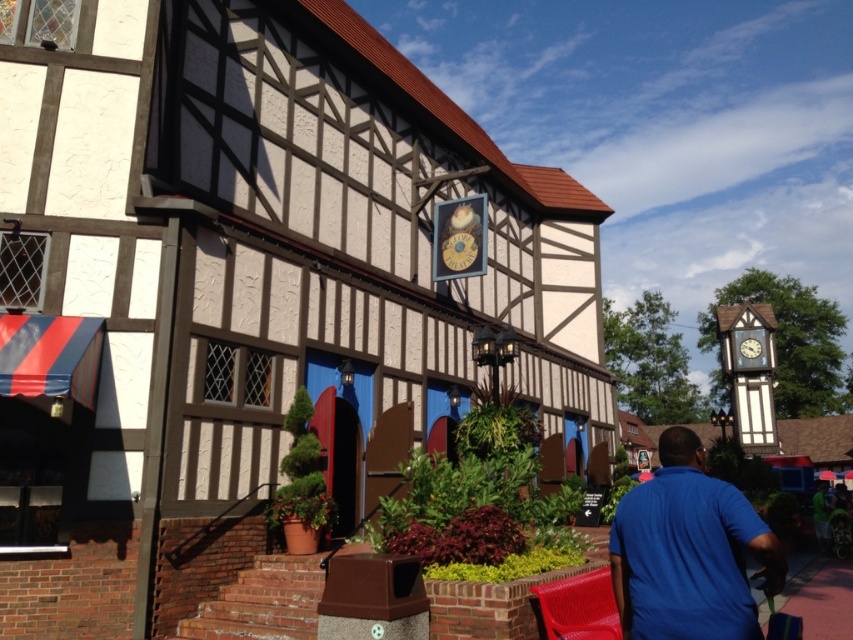
Question: Does blue matte shirt at center appear on the right side of wooden clock at center?

Choices:
 (A) yes
 (B) no

Answer: (B)

Question: Which object appears farthest from the camera in this image?

Choices:
 (A) wooden clock at center
 (B) blue matte shirt at center

Answer: (A)

Question: Among these points, which one is nearest to the camera?

Choices:
 (A) (699, 618)
 (B) (750, 355)

Answer: (A)

Question: Does blue matte shirt at center appear under wooden clock at center?

Choices:
 (A) yes
 (B) no

Answer: (A)

Question: Is blue matte shirt at center to the left of wooden clock at center from the viewer's perspective?

Choices:
 (A) no
 (B) yes

Answer: (B)